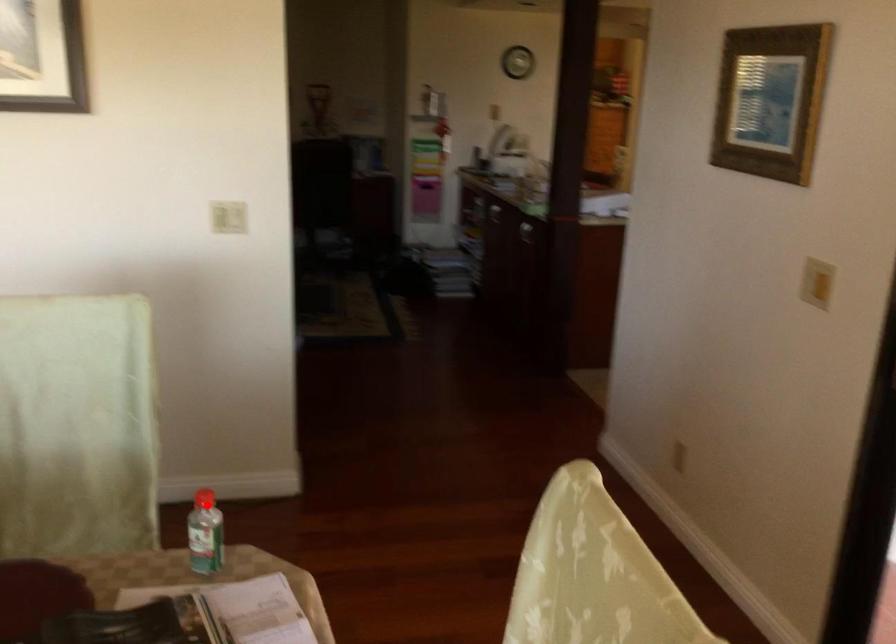
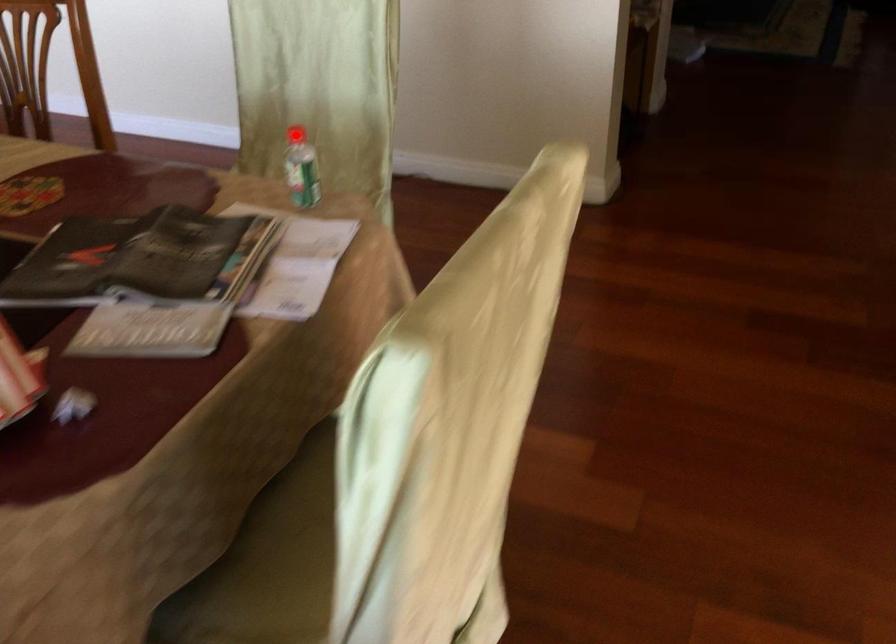
I am providing you with two images of the same scene from different viewpoints. A red point is marked on the first image and another point is marked on the second image. Does the point marked in image1 correspond to the same location as the one in image2?

Yes